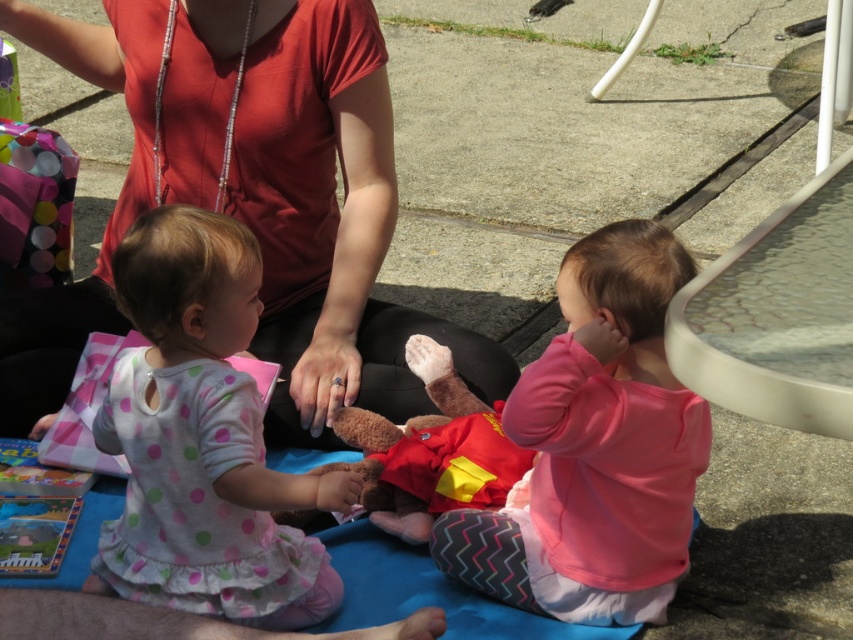
You are a photographer setting up for a family photo. You need to place a small prop between the white polka dot fabric at center and the pink fleece sweater at center so it doesn t get covered. Based on their widths, where should you place the prop?

The white polka dot fabric at center might be wider than the pink fleece sweater at center, so placing the prop closer to the pink fleece sweater at center would reduce the chance of it being covered by the wider white polka dot fabric at center.

You are a photographer trying to capture a closeup shot of both the matte red shirt at center and the white polka dot fabric at center. Given that your camera has a minimum focus distance of 50 centimeters, will you be able to focus on both subjects simultaneously?

The matte red shirt at center and white polka dot fabric at center are 60.40 centimeters apart from each other, which is greater than the camera minimum focus distance of 50 centimeters. Therefore, the photographer can focus on both subjects simultaneously.

You are a photographer trying to capture a clear shot of the white polka dot fabric at center and the pink fleece sweater at center. Since both are at the center, which one do you need to focus on first to ensure both are in focus?

The white polka dot fabric at center is in front of the pink fleece sweater at center, so you should focus on the white polka dot fabric at center first to ensure both are in focus.